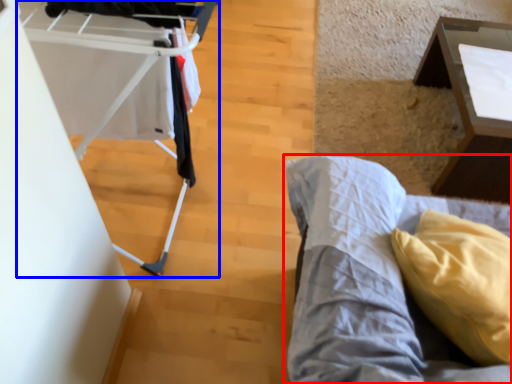
Question: Which of the following is the closest to the observer, furniture (highlighted by a red box) or baby carriage (highlighted by a blue box)?

Choices:
 (A) furniture
 (B) baby carriage

Answer: (A)